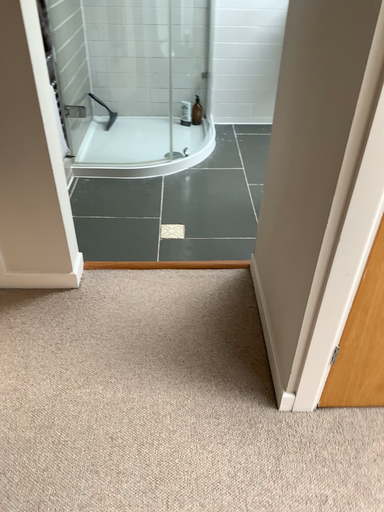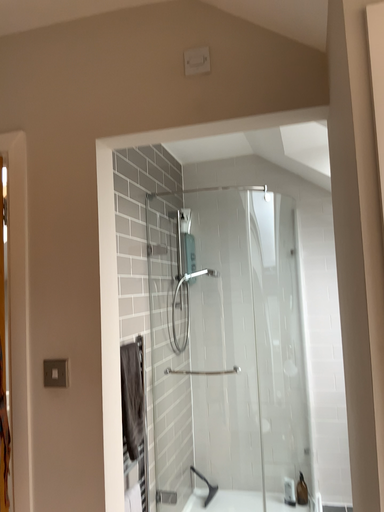
Question: Which way did the camera rotate in the video?

Choices:
 (A) rotated left
 (B) rotated right

Answer: (A)